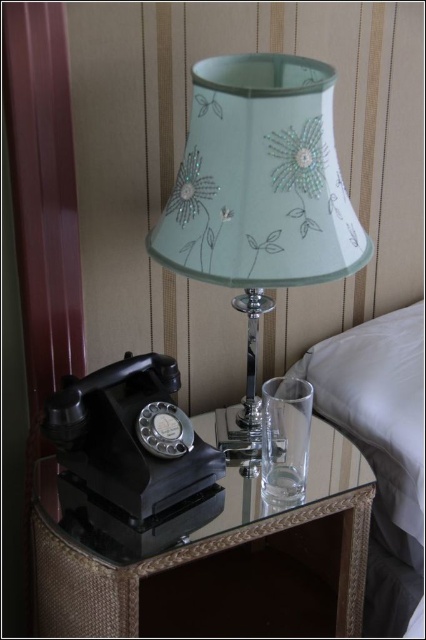
This screenshot has height=640, width=426. Identify the location of white fabric bed at right. (379, 417).

Is the position of white fabric bed at right less distant than that of matte black rotary phone at left?

That is False.

Which is behind, point (386, 426) or point (198, 477)?

The point (386, 426) is behind.

The height and width of the screenshot is (640, 426). In order to click on white fabric bed at right in this screenshot , I will do `click(379, 417)`.

Measure the distance from light blue glass lampshade at upper center to white fabric bed at right.

15.62 inches

Who is positioned more to the right, light blue glass lampshade at upper center or white fabric bed at right?

white fabric bed at right is more to the right.

Is point (167, 200) farther from camera compared to point (400, 369)?

No, it is in front of (400, 369).

At what (x,y) coordinates should I click in order to perform the action: click on light blue glass lampshade at upper center. Please return your answer as a coordinate pair (x, y). This screenshot has height=640, width=426. Looking at the image, I should click on (259, 198).

Can you confirm if light blue glass lampshade at upper center is bigger than matte black rotary phone at left?

Correct, light blue glass lampshade at upper center is larger in size than matte black rotary phone at left.

Is light blue glass lampshade at upper center shorter than matte black rotary phone at left?

Incorrect, light blue glass lampshade at upper center's height does not fall short of matte black rotary phone at left's.

Is point (233, 422) closer to camera compared to point (137, 452)?

No, (233, 422) is behind (137, 452).

Identify the location of light blue glass lampshade at upper center. This screenshot has height=640, width=426. (259, 198).